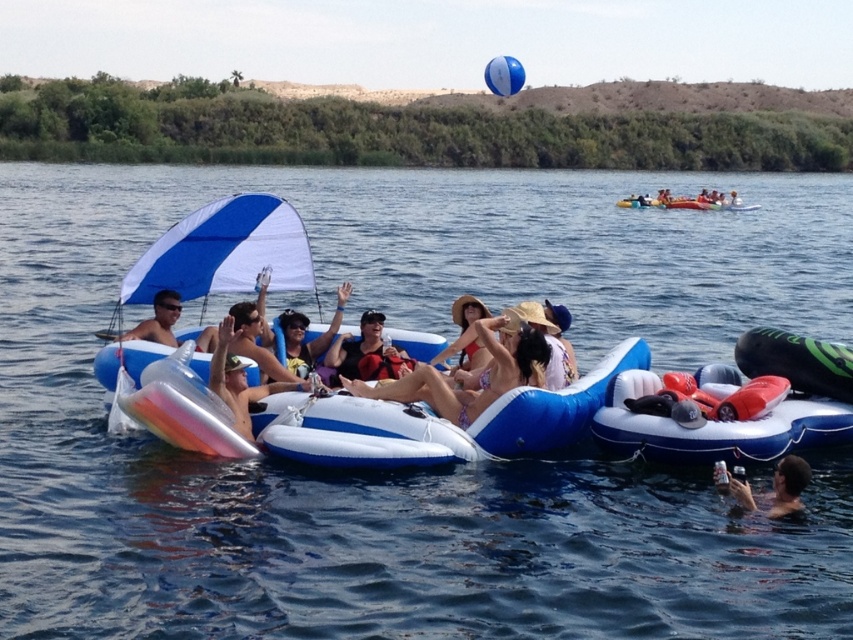
Question: In this image, where is smooth skin person at lower right located relative to matte black sunglasses at left?

Choices:
 (A) left
 (B) right

Answer: (B)

Question: Which object appears farthest from the camera in this image?

Choices:
 (A) matte red bikini at center
 (B) matte black life vest at center

Answer: (B)

Question: Is smooth skin person at lower right smaller than matte black sunglasses at center?

Choices:
 (A) yes
 (B) no

Answer: (A)

Question: Does matte black life vest at center have a lesser width compared to matte black sunglasses at left?

Choices:
 (A) yes
 (B) no

Answer: (B)

Question: Which of these objects is positioned farthest from the matte red bikini at center?

Choices:
 (A) yellow rubber boat at center
 (B) matte black sunglasses at center
 (C) pink bikini at center

Answer: (A)

Question: Which point is farther to the camera?

Choices:
 (A) (780, 470)
 (B) (173, 294)

Answer: (B)